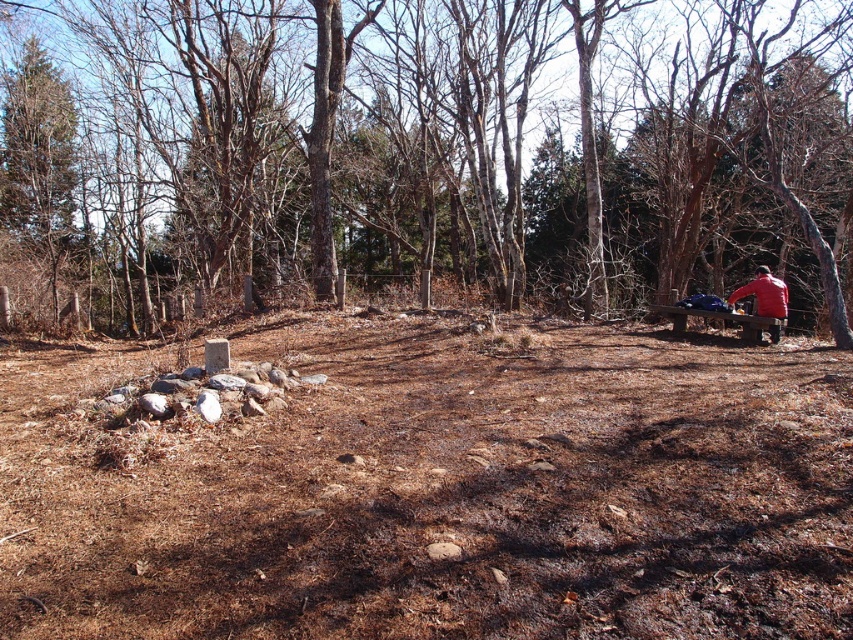
Question: Which object is the farthest from the brown wooden bench at right?

Choices:
 (A) brown bark tree at center
 (B) red matte jacket at right

Answer: (A)

Question: Which of these objects is positioned closest to the brown wooden bench at right?

Choices:
 (A) red matte jacket at right
 (B) brown bark tree at center

Answer: (A)

Question: Based on their relative distances, which object is nearer to the brown bark tree at center?

Choices:
 (A) brown wooden bench at right
 (B) red matte jacket at right

Answer: (A)

Question: Is brown wooden bench at right bigger than red matte jacket at right?

Choices:
 (A) yes
 (B) no

Answer: (B)

Question: Is brown bark tree at center thinner than brown wooden bench at right?

Choices:
 (A) yes
 (B) no

Answer: (B)

Question: Can you confirm if brown bark tree at center is positioned to the right of red matte jacket at right?

Choices:
 (A) no
 (B) yes

Answer: (A)